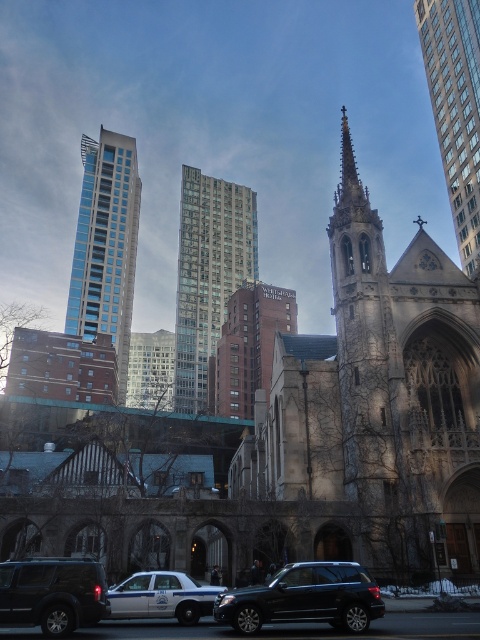
You are an architect analyzing the image. You need to determine which structure has a greater height between the stone church steeple at upper right and the brick textured building at center. Based on the scene, which one is taller?

The stone church steeple at upper right is taller than the brick textured building at center.

You are a drone operator planning to film a scene where the stone church steeple at upper right must be visible in the background of a shot focused on the modern high rises. Given that the drone can only maintain a stable shot when the distance between the foreground and background objects is less than 300 feet, will this setup work?

The distance between the stone church steeple at upper right and the modern high rises is 301.46 feet. Since this exceeds the drone operator requirement of less than 300 feet for a stable shot, the setup will not work.

You are a city planner assessing the visual balance between historical and modern elements in an urban landscape. Given the stone church steeple at upper right and the black matte suv at lower left, which object appears narrower in the image?

The stone church steeple at upper right appears narrower than the black matte suv at lower left.